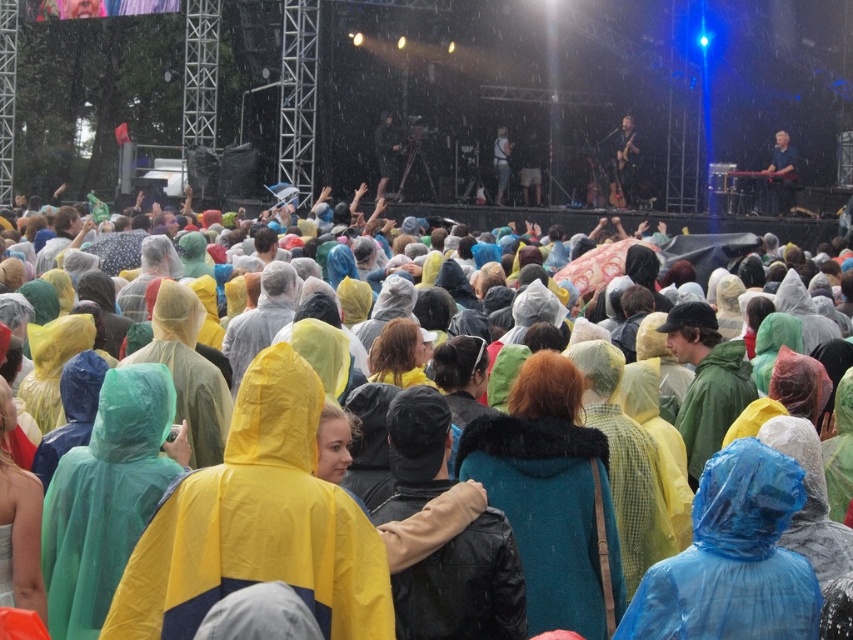
Question: Estimate the real-world distances between objects in this image. Which object is farther from the teal fur-trimmed coat at center?

Choices:
 (A) smooth black guitar at upper right
 (B) shiny black guitar at upper right

Answer: (B)

Question: Which object is closer to the camera taking this photo?

Choices:
 (A) shiny black guitar at upper right
 (B) smooth black guitar at upper right

Answer: (B)

Question: Where is teal fur-trimmed coat at center located in relation to smooth black guitar at upper right in the image?

Choices:
 (A) above
 (B) below

Answer: (B)

Question: Can you confirm if teal fur-trimmed coat at center is smaller than shiny black guitar at upper right?

Choices:
 (A) no
 (B) yes

Answer: (A)

Question: Does teal fur-trimmed coat at center come in front of smooth black guitar at upper right?

Choices:
 (A) yes
 (B) no

Answer: (A)

Question: Which object is positioned farthest from the shiny black guitar at upper right?

Choices:
 (A) smooth black guitar at upper right
 (B) teal fur-trimmed coat at center

Answer: (B)